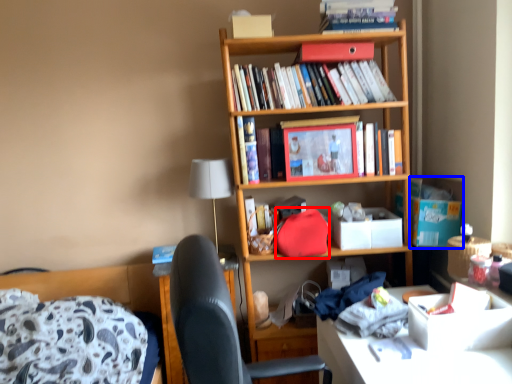
Question: Which object appears closest to the camera in this image, handbag (highlighted by a red box) or cardboard box (highlighted by a blue box)?

Choices:
 (A) handbag
 (B) cardboard box

Answer: (A)